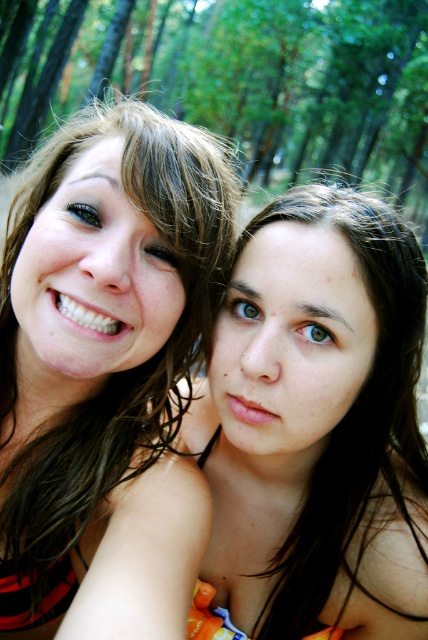
You are a photographer trying to capture a closeup of the matte black bikini top at left and the green leafy trees at upper center in the background. Given that your camera can only focus on objects within a 20 feet range, will both subjects be in focus?

The matte black bikini top at left is 27.16 feet away from the green leafy trees at upper center. Since the camera can only focus within 20 feet, the distance between them exceeds the focus range, so both subjects cannot be in focus simultaneously.

Looking at this image, you are a photographer trying to capture a portrait of the two people in the scene. Given that the matte black bikini top at left and the green leafy trees at upper center are both in the frame, which object should you adjust your focus to ensure the person on the left is the main subject?

You should focus on the matte black bikini top at left since it is closer to the camera than the green leafy trees at upper center, which are taller but farther away.

In the scene shown: You are a photographer trying to focus on two points in the image. The first point is at coordinates point (x=183, y=324) and the second is at point (x=321, y=86). Which point should you adjust your camera focus to first if you want to focus on the closer one?

Point (x=183, y=324) is closer to the camera than point (x=321, y=86), so you should adjust your camera focus to point (x=183, y=324) first.